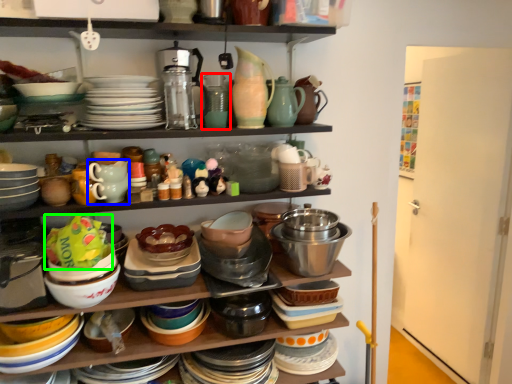
Question: Which object is positioned farthest from tableware (highlighted by a red box)? Select from tableware (highlighted by a blue box) and food (highlighted by a green box).

Choices:
 (A) tableware
 (B) food

Answer: (B)